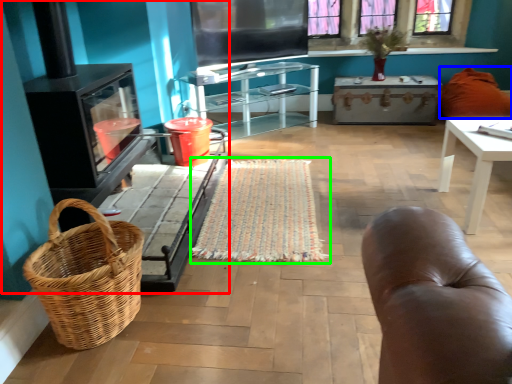
Question: Which object is the closest to the fireplace (highlighted by a red box)? Choose among these: pillow (highlighted by a blue box) or mat (highlighted by a green box).

Choices:
 (A) pillow
 (B) mat

Answer: (B)